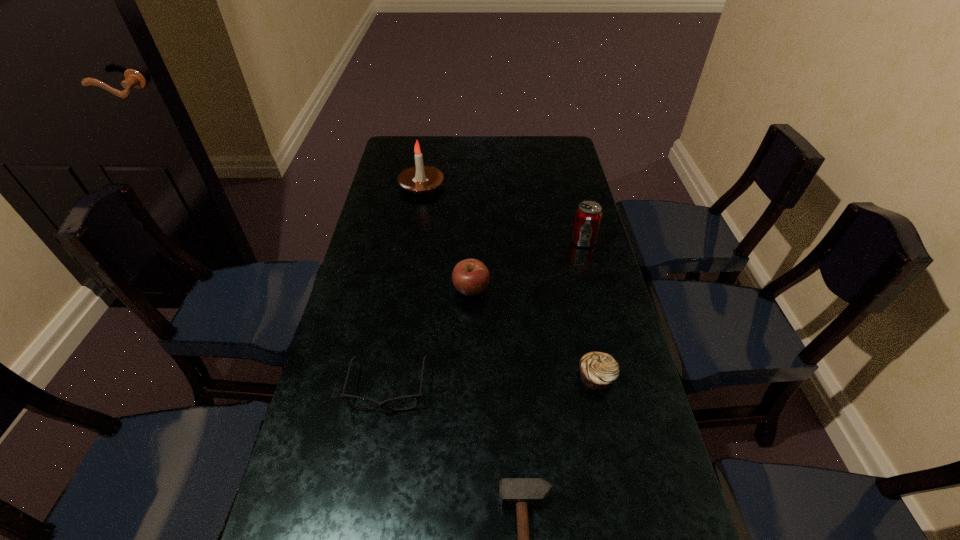
Image resolution: width=960 pixels, height=540 pixels. Identify the location of vacant space that satisfies the following two spatial constraints: 1. on the front side of the pop soda; 2. on the right side of the farthest object. (413, 241).